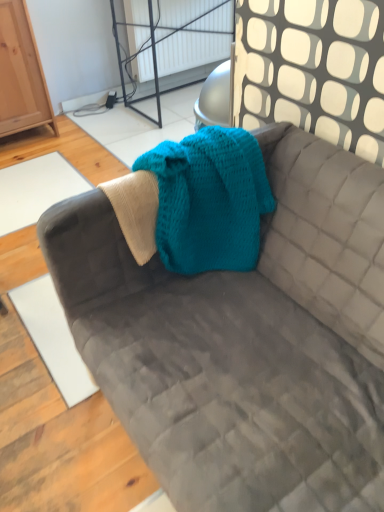
Question: Should I look upward or downward to see velvet gray couch at center?

Choices:
 (A) down
 (B) up

Answer: (A)